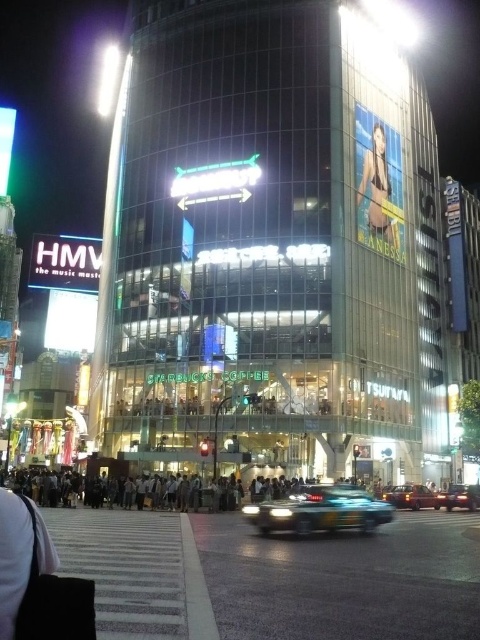
Question: From the image, what is the correct spatial relationship of clear plastic billboard at upper center in relation to shiny red car at lower right?

Choices:
 (A) left
 (B) right

Answer: (A)

Question: Which of the following is the farthest from the observer?

Choices:
 (A) shiny red car at lower right
 (B) matte red sedan at center
 (C) metallic blue car at center

Answer: (A)

Question: Does metallic blue car at center lie behind matte red sedan at center?

Choices:
 (A) no
 (B) yes

Answer: (A)

Question: Which object is farther from the camera taking this photo?

Choices:
 (A) clear plastic billboard at upper center
 (B) metallic blue car at center
 (C) matte red sedan at center
 (D) shiny red car at lower right

Answer: (A)

Question: Is matte red sedan at center bigger than shiny red car at lower right?

Choices:
 (A) yes
 (B) no

Answer: (B)

Question: Which point is closer to the camera?

Choices:
 (A) metallic blue car at center
 (B) shiny red car at lower right
 (C) clear plastic billboard at upper center

Answer: (A)